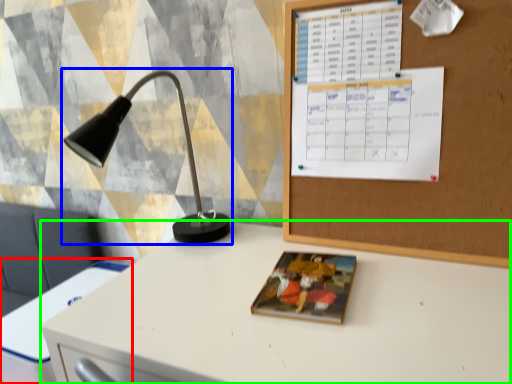
Question: Which is farther away from computer desk (highlighted by a red box)? lamp (highlighted by a blue box) or desk (highlighted by a green box)?

Choices:
 (A) lamp
 (B) desk

Answer: (A)